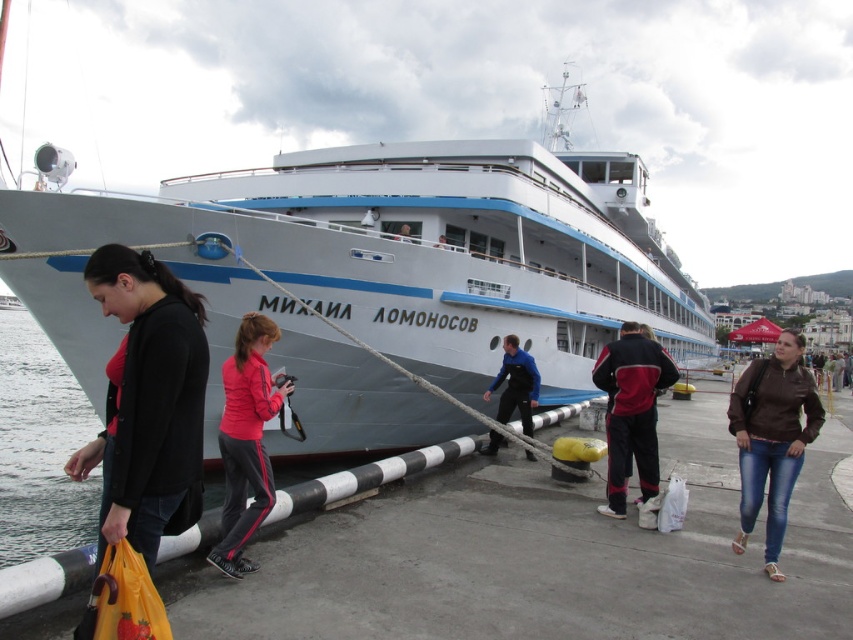
You are a photographer standing on the dock next to the large passenger ship. You see a person with a red fabric jacket at center and another person with a camera. Which object is closer to you?

The red fabric jacket at center is closer to you since the camera is 7.42 meters away from it.

You are a photographer standing at the dock and want to take a picture of the two jackets. The matte black jacket at lower left and the brown leather jacket at lower right. Which jacket should you focus on if you want to capture the one that is shorter in height?

The matte black jacket at lower left is shorter than the brown leather jacket at lower right, so you should focus on the matte black jacket at lower left to capture the shorter one.